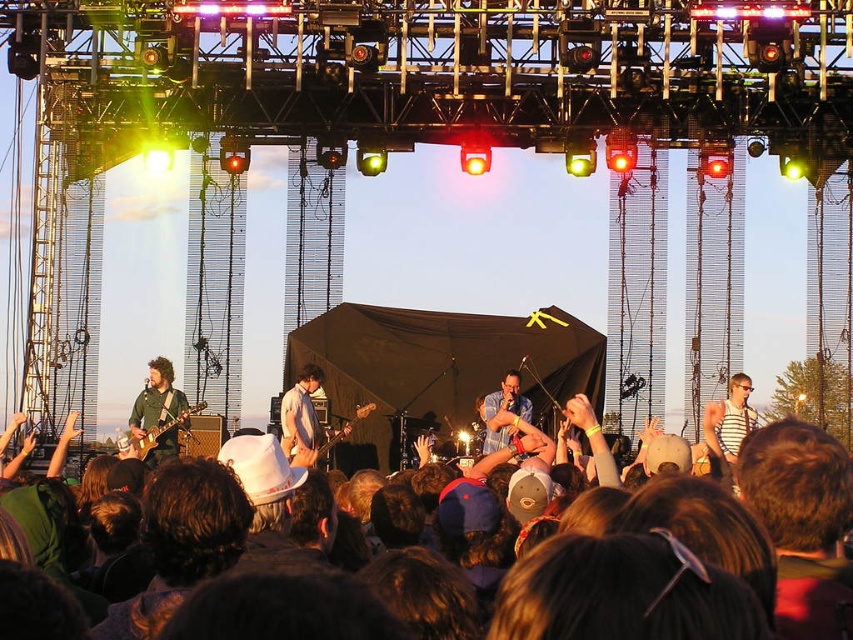
You are a photographer trying to capture the main performer at the concert. You notice the brown hair at center and the light blue fabric guitar at center. Which object should you focus on if you want to emphasize the performer in your photo?

The brown hair at center is larger in size than the light blue fabric guitar at center, so focusing on the brown hair at center would emphasize the performer since it is the larger object.

You are a photographer standing at the camera position. You want to capture a closeup shot of the brown hair at center. Given that your camera has a maximum zoom range of 100 meters, can you achieve this?

The brown hair at center and camera are 146.62 meters apart from each other. Since the maximum zoom range is 100 meters, the camera cannot capture a closeup shot of the brown hair at center as the distance exceeds the zoom capability.

You are a stagehand who needs to move the light blue fabric guitar at center and the matte brown electric guitar at left. Which one is closer to the right side of the stage?

The light blue fabric guitar at center is closer to the right side of the stage because it is positioned to the right of the matte brown electric guitar at left.